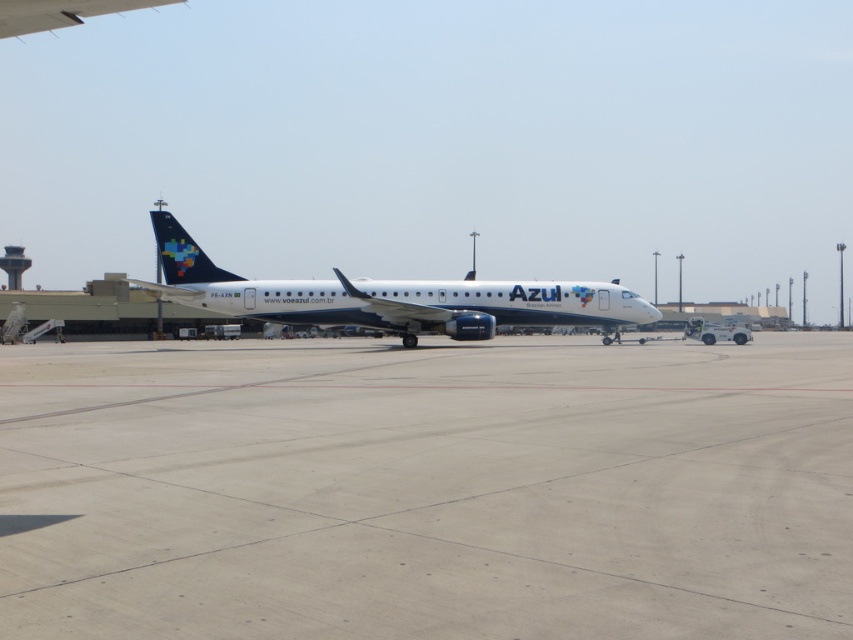
Question: Is smooth concrete tarmac at center wider than white glossy airplane at center?

Choices:
 (A) no
 (B) yes

Answer: (A)

Question: Which point appears closest to the camera in this image?

Choices:
 (A) (260, 316)
 (B) (843, 403)

Answer: (B)

Question: In this image, where is smooth concrete tarmac at center located relative to white glossy airplane at center?

Choices:
 (A) below
 (B) above

Answer: (A)

Question: Does smooth concrete tarmac at center appear under white glossy airplane at center?

Choices:
 (A) no
 (B) yes

Answer: (B)